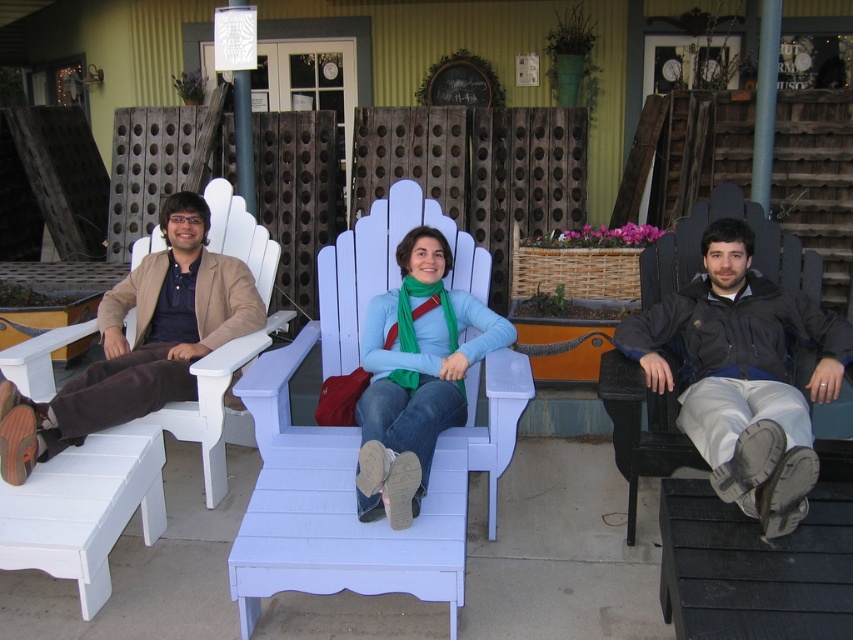
Does white wood chair at center have a smaller size compared to dark gray jacket at right?

Incorrect, white wood chair at center is not smaller in size than dark gray jacket at right.

Which is more to the right, white wood chair at center or dark gray jacket at right?

dark gray jacket at right is more to the right.

Who is more distant from viewer, (521, 384) or (796, 321)?

Point (796, 321)

In order to click on white wood chair at center in this screenshot , I will do `click(355, 451)`.

Is dark gray jacket at right shorter than matte green scarf at center?

Indeed, dark gray jacket at right has a lesser height compared to matte green scarf at center.

Does point (786, 381) come farther from viewer compared to point (395, 390)?

Yes, point (786, 381) is farther from viewer.

This screenshot has width=853, height=640. What are the coordinates of `dark gray jacket at right` in the screenshot? It's located at (741, 374).

Can you confirm if matte brown jacket at left is taller than matte green scarf at center?

Indeed, matte brown jacket at left has a greater height compared to matte green scarf at center.

Does matte brown jacket at left appear on the right side of matte green scarf at center?

Incorrect, matte brown jacket at left is not on the right side of matte green scarf at center.

Where is `matte brown jacket at left`? Image resolution: width=853 pixels, height=640 pixels. matte brown jacket at left is located at coordinates pos(138,342).

Find the location of a particular element. The image size is (853, 640). matte brown jacket at left is located at coordinates (138, 342).